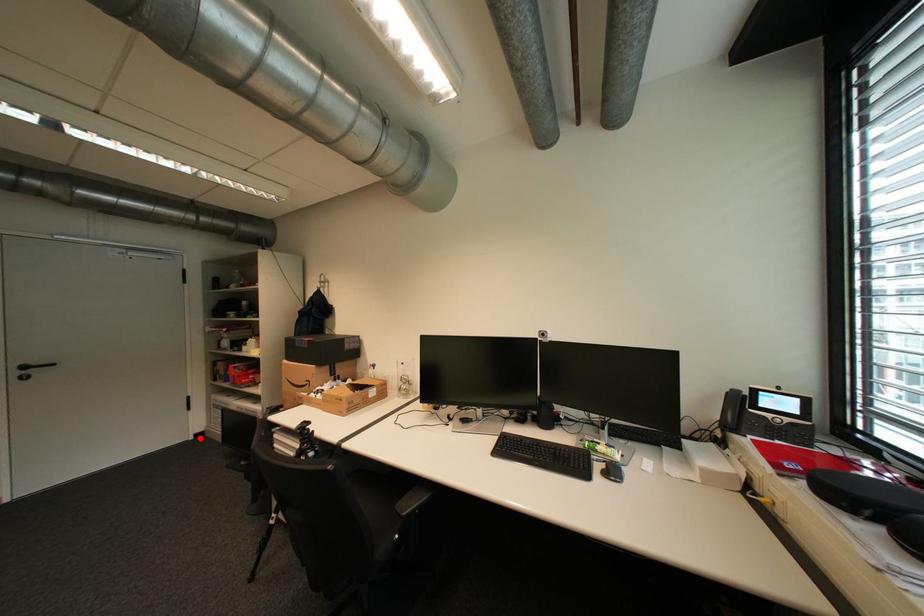
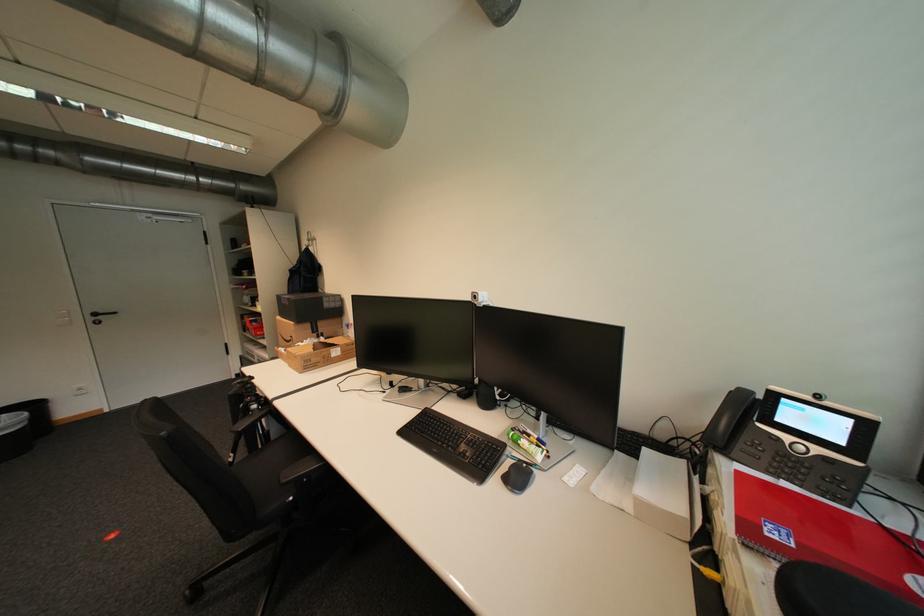
Question: I am providing you with two images of the same scene from different viewpoints. A red point is marked on the first image. Can you still see the location of the red point in image 2?

Choices:
 (A) Yes
 (B) No

Answer: (A)